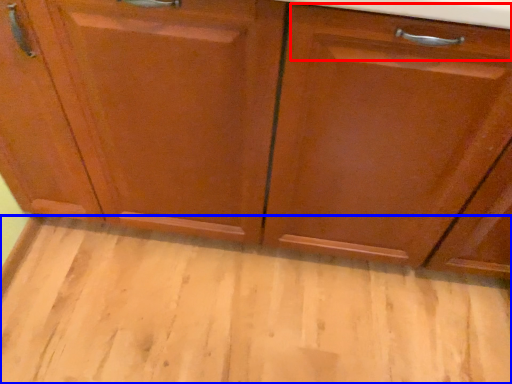
Question: Which point is closer to the camera, drawer (highlighted by a red box) or plain (highlighted by a blue box)?

Choices:
 (A) drawer
 (B) plain

Answer: (A)